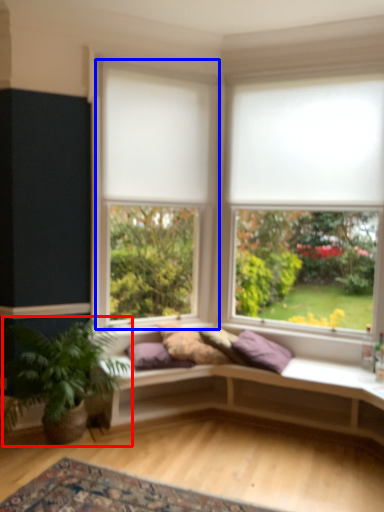
Question: Which object appears closest to the camera in this image, houseplant (highlighted by a red box) or window (highlighted by a blue box)?

Choices:
 (A) houseplant
 (B) window

Answer: (A)